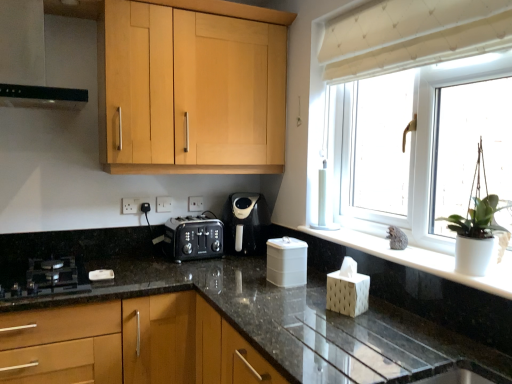
Where is `blank space above black plastic toaster at center (from a real-world perspective)`? blank space above black plastic toaster at center (from a real-world perspective) is located at coordinates (189, 220).